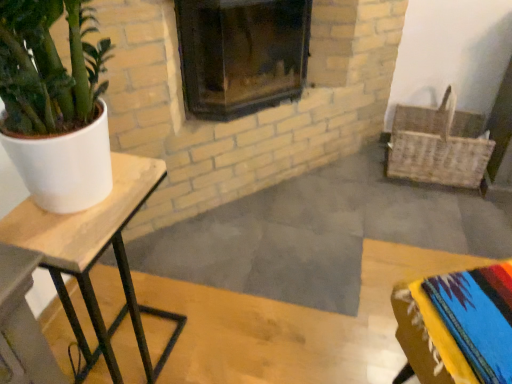
Question: Is woven wicker basket at right a part of dark glass fireplace at center?

Choices:
 (A) yes
 (B) no

Answer: (B)

Question: Is dark glass fireplace at center thinner than woven wicker basket at right?

Choices:
 (A) yes
 (B) no

Answer: (B)

Question: Is dark glass fireplace at center directly adjacent to woven wicker basket at right?

Choices:
 (A) yes
 (B) no

Answer: (B)

Question: Does dark glass fireplace at center have a greater width compared to woven wicker basket at right?

Choices:
 (A) yes
 (B) no

Answer: (A)

Question: Considering the relative sizes of dark glass fireplace at center and woven wicker basket at right in the image provided, is dark glass fireplace at center taller than woven wicker basket at right?

Choices:
 (A) no
 (B) yes

Answer: (B)

Question: Could you tell me if dark glass fireplace at center is facing woven wicker basket at right?

Choices:
 (A) yes
 (B) no

Answer: (B)

Question: Does woven wicker basket at right lie in front of dark glass fireplace at center?

Choices:
 (A) no
 (B) yes

Answer: (A)

Question: Does woven wicker basket at right have a greater height compared to dark glass fireplace at center?

Choices:
 (A) yes
 (B) no

Answer: (B)

Question: Is dark glass fireplace at center at the back of woven wicker basket at right?

Choices:
 (A) no
 (B) yes

Answer: (A)

Question: From the image's perspective, is woven wicker basket at right located beneath dark glass fireplace at center?

Choices:
 (A) yes
 (B) no

Answer: (A)

Question: From the image's perspective, is woven wicker basket at right on top of dark glass fireplace at center?

Choices:
 (A) no
 (B) yes

Answer: (A)

Question: Considering the relative sizes of woven wicker basket at right and dark glass fireplace at center in the image provided, is woven wicker basket at right shorter than dark glass fireplace at center?

Choices:
 (A) yes
 (B) no

Answer: (A)

Question: Are woven wicker basket at right and wooden table at left located far from each other?

Choices:
 (A) no
 (B) yes

Answer: (B)